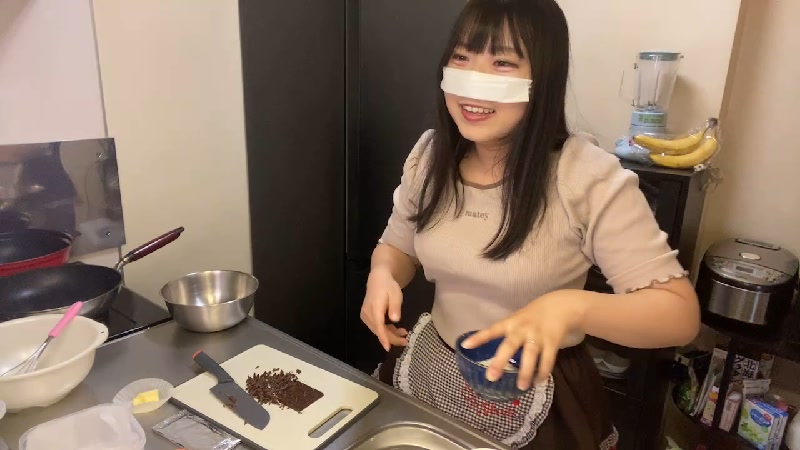
The width and height of the screenshot is (800, 450). Find the location of `cup set`. cup set is located at coordinates (602, 362).